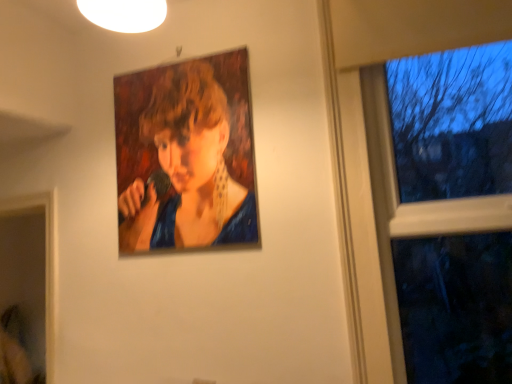
Find the location of a particular element. transparent glass window at right is located at coordinates click(x=444, y=210).

What do you see at coordinates (444, 210) in the screenshot? I see `transparent glass window at right` at bounding box center [444, 210].

This screenshot has height=384, width=512. What do you see at coordinates (189, 168) in the screenshot?
I see `oil painting portrait at upper center` at bounding box center [189, 168].

The width and height of the screenshot is (512, 384). What are the coordinates of `oil painting portrait at upper center` in the screenshot? It's located at (189, 168).

This screenshot has width=512, height=384. What are the coordinates of `transparent glass window at right` in the screenshot? It's located at pyautogui.click(x=444, y=210).

Which is more to the left, transparent glass window at right or oil painting portrait at upper center?

oil painting portrait at upper center.

Is transparent glass window at right in front of or behind oil painting portrait at upper center in the image?

Visually, transparent glass window at right is located in front of oil painting portrait at upper center.

Does point (391, 128) come farther from viewer compared to point (198, 192)?

No, it is not.

From the image's perspective, between transparent glass window at right and oil painting portrait at upper center, which one is located above?

A: From the image's view, oil painting portrait at upper center is above.

From a real-world perspective, between transparent glass window at right and oil painting portrait at upper center, who is vertically higher?

oil painting portrait at upper center, from a real-world perspective.

Which object is wider, transparent glass window at right or oil painting portrait at upper center?

Wider between the two is transparent glass window at right.

Can you confirm if transparent glass window at right is shorter than oil painting portrait at upper center?

Incorrect, the height of transparent glass window at right does not fall short of that of oil painting portrait at upper center.

Consider the image. In terms of size, does transparent glass window at right appear bigger or smaller than oil painting portrait at upper center?

Clearly, transparent glass window at right is larger in size than oil painting portrait at upper center.

Would you say transparent glass window at right contains oil painting portrait at upper center?

No, oil painting portrait at upper center is located outside of transparent glass window at right.

Is transparent glass window at right in contact with oil painting portrait at upper center?

No, transparent glass window at right is not making contact with oil painting portrait at upper center.

Is transparent glass window at right looking in the opposite direction of oil painting portrait at upper center?

No, transparent glass window at right's orientation is not away from oil painting portrait at upper center.

How many degrees apart are the facing directions of transparent glass window at right and oil painting portrait at upper center?

They differ by 0.194 degrees in their facing directions.

This screenshot has height=384, width=512. Identify the location of person above the transparent glass window at right (from the image's perspective). (189, 168).

Considering the relative positions of oil painting portrait at upper center and transparent glass window at right in the image provided, is oil painting portrait at upper center to the left or to the right of transparent glass window at right?

Clearly, oil painting portrait at upper center is on the left of transparent glass window at right in the image.

Is oil painting portrait at upper center further to the viewer compared to transparent glass window at right?

Yes.

Which is in front, point (197, 217) or point (484, 63)?

The point (484, 63) is closer to the camera.

From the image's perspective, is oil painting portrait at upper center located above or below transparent glass window at right?

oil painting portrait at upper center is above transparent glass window at right.

From a real-world perspective, who is located lower, oil painting portrait at upper center or transparent glass window at right?

transparent glass window at right.

Does oil painting portrait at upper center have a lesser width compared to transparent glass window at right?

Correct, the width of oil painting portrait at upper center is less than that of transparent glass window at right.

Considering the sizes of objects oil painting portrait at upper center and transparent glass window at right in the image provided, who is taller, oil painting portrait at upper center or transparent glass window at right?

Standing taller between the two is transparent glass window at right.

Considering the sizes of objects oil painting portrait at upper center and transparent glass window at right in the image provided, who is smaller, oil painting portrait at upper center or transparent glass window at right?

Smaller between the two is oil painting portrait at upper center.

Is oil painting portrait at upper center not within transparent glass window at right?

That's correct, oil painting portrait at upper center is outside of transparent glass window at right.

Is oil painting portrait at upper center positioned far away from transparent glass window at right?

No, oil painting portrait at upper center is not far away from transparent glass window at right.

Could you tell me if oil painting portrait at upper center is facing transparent glass window at right?

No.

Can you tell me how much oil painting portrait at upper center and transparent glass window at right differ in facing direction?

0.194 degrees.

At what (x,y) coordinates should I click in order to perform the action: click on person that is behind the transparent glass window at right. Please return your answer as a coordinate pair (x, y). Looking at the image, I should click on [189, 168].

Where is `window located underneath the oil painting portrait at upper center (from a real-world perspective)`? The width and height of the screenshot is (512, 384). window located underneath the oil painting portrait at upper center (from a real-world perspective) is located at coordinates (444, 210).

What are the coordinates of `window in front of the oil painting portrait at upper center` in the screenshot? It's located at (444, 210).